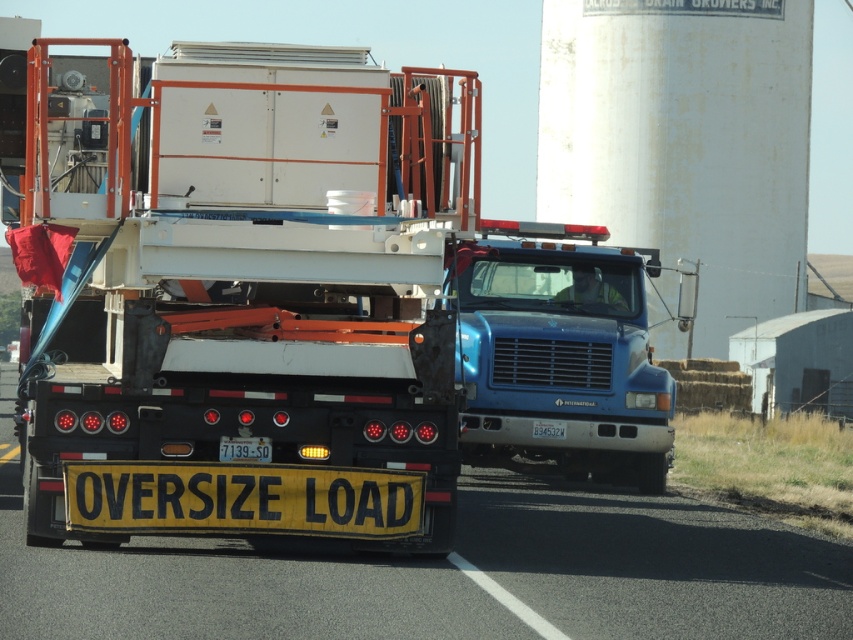
Can you confirm if white plastic trailer at center is thinner than white painted concrete water tower at upper center?

In fact, white plastic trailer at center might be wider than white painted concrete water tower at upper center.

Does white plastic trailer at center have a greater width compared to white painted concrete water tower at upper center?

Indeed, white plastic trailer at center has a greater width compared to white painted concrete water tower at upper center.

Which is behind, point (694, 524) or point (790, 170)?

The point (790, 170) is more distant.

Where is `white plastic trailer at center`? white plastic trailer at center is located at coordinates (444, 573).

Does yellowmaterial/texturelicense plate at center appear on the left side of yellow plastic license plate at center?

Indeed, yellowmaterial/texturelicense plate at center is positioned on the left side of yellow plastic license plate at center.

Identify the location of yellowmaterial/texturelicense plate at center. This screenshot has width=853, height=640. (244, 449).

Locate an element on the screen. yellowmaterial/texturelicense plate at center is located at coordinates (x=244, y=449).

Can you confirm if white matte container at center is bigger than blue metallic truck at center?

No, white matte container at center is not bigger than blue metallic truck at center.

Who is more distant from viewer, (x=48, y=470) or (x=660, y=410)?

Positioned behind is point (x=660, y=410).

Where is `white matte container at center`? The width and height of the screenshot is (853, 640). white matte container at center is located at coordinates (242, 294).